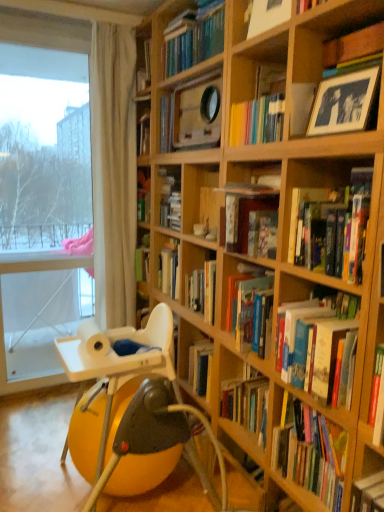
Identify the location of free spot to the left of white plastic chair at lower left. (32, 467).